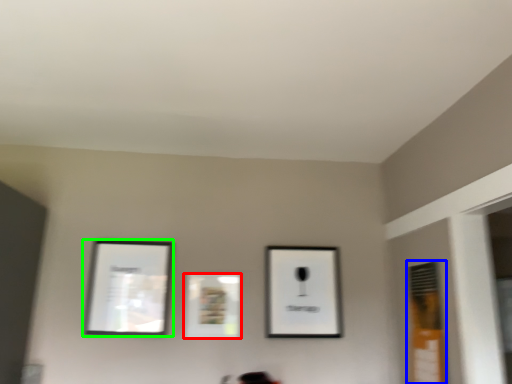
Question: Considering the real-world distances, which object is farthest from picture frame (highlighted by a red box)? window (highlighted by a blue box) or picture frame (highlighted by a green box)?

Choices:
 (A) window
 (B) picture frame

Answer: (A)